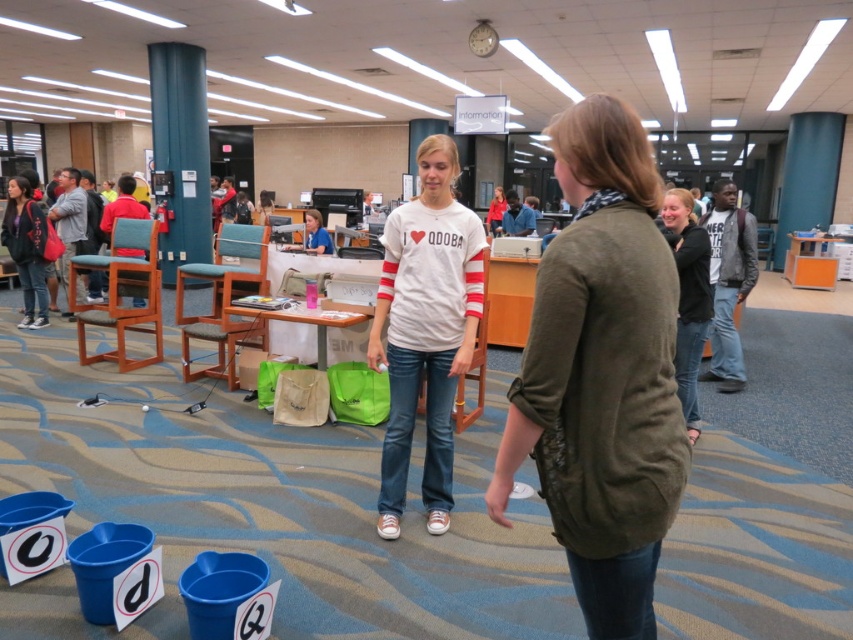
From the picture: How far apart are white cotton shirt at center and matte black jacket at left?

A distance of 4.56 meters exists between white cotton shirt at center and matte black jacket at left.

Does white cotton shirt at center appear on the left side of matte black jacket at left?

In fact, white cotton shirt at center is to the right of matte black jacket at left.

Where is `white cotton shirt at center`? This screenshot has width=853, height=640. white cotton shirt at center is located at coordinates (425, 330).

Who is positioned more to the right, white cotton shirt at center or dark gray sweater at center?

dark gray sweater at center

Does point (404, 260) come closer to viewer compared to point (685, 298)?

That is True.

Where is `white cotton shirt at center`? white cotton shirt at center is located at coordinates (425, 330).

Is olive green sweater at center taller than white cotton shirt at center?

No, olive green sweater at center is not taller than white cotton shirt at center.

Who is taller, olive green sweater at center or white cotton shirt at center?

white cotton shirt at center

Between point (625, 554) and point (440, 221), which one is positioned behind?

Positioned behind is point (440, 221).

Locate an element on the screen. Image resolution: width=853 pixels, height=640 pixels. olive green sweater at center is located at coordinates (602, 372).